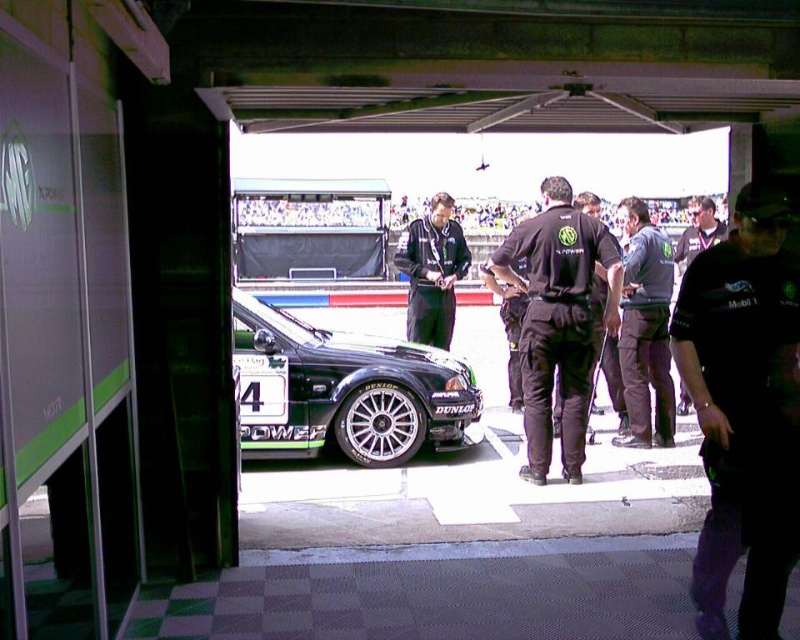
Looking at this image, who is positioned more to the right, black fabric shirt at center or dark gray uniform at center?

From the viewer's perspective, dark gray uniform at center appears more on the right side.

At what (x,y) coordinates should I click in order to perform the action: click on black fabric shirt at center. Please return your answer as a coordinate pair (x, y). The width and height of the screenshot is (800, 640). Looking at the image, I should click on (744, 412).

Is black fabric uniform at center taller than dark gray uniform at center?

Indeed, black fabric uniform at center has a greater height compared to dark gray uniform at center.

Does point (570, 445) come closer to viewer compared to point (628, 444)?

Yes, point (570, 445) is closer to viewer.

Where is `black fabric uniform at center`? black fabric uniform at center is located at coordinates (558, 321).

I want to click on black fabric shirt at center, so click(744, 412).

Is point (748, 252) positioned behind point (404, 257)?

That is False.

You are a GUI agent. You are given a task and a screenshot of the screen. Output one action in this format:
    pyautogui.click(x=<x>, y=<y>)
    Task: Click on the black fabric shirt at center
    This screenshot has height=640, width=800.
    Given the screenshot: What is the action you would take?
    pyautogui.click(x=744, y=412)